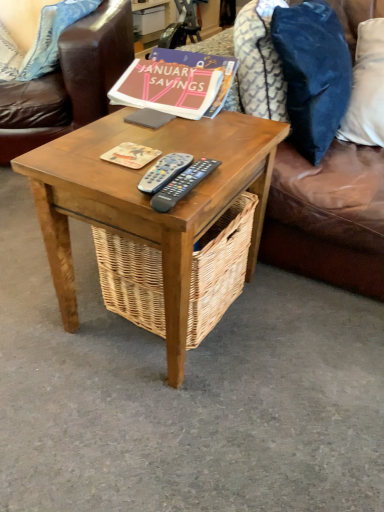
Find the location of a particular element. The width and height of the screenshot is (384, 512). free point in front of woven wood picnic basket at center is located at coordinates (180, 396).